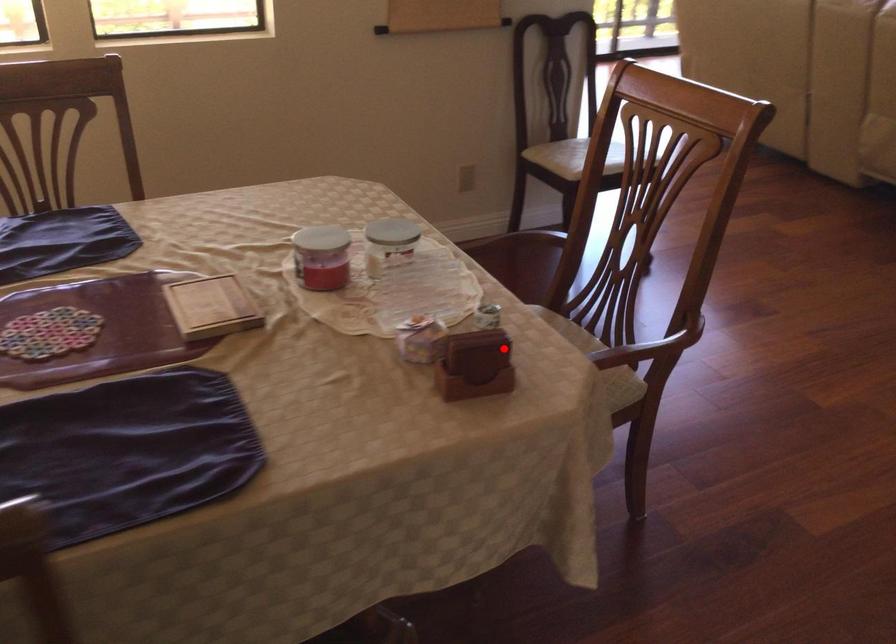
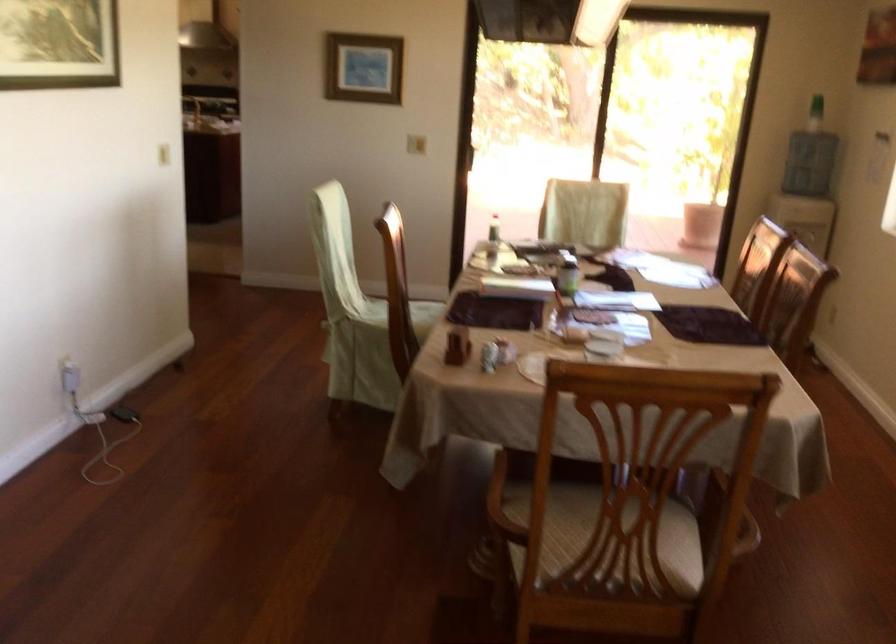
Question: I am providing you with two images of the same scene from different viewpoints. A red point is shown in image1. For the corresponding object point in image2, is it positioned nearer or farther from the camera?

Choices:
 (A) Nearer
 (B) Farther

Answer: (B)